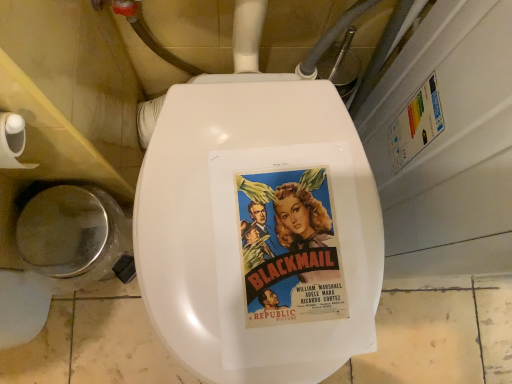
Identify the location of free point above vintage paper poster at center (from a real-world perspective). The width and height of the screenshot is (512, 384). (287, 239).